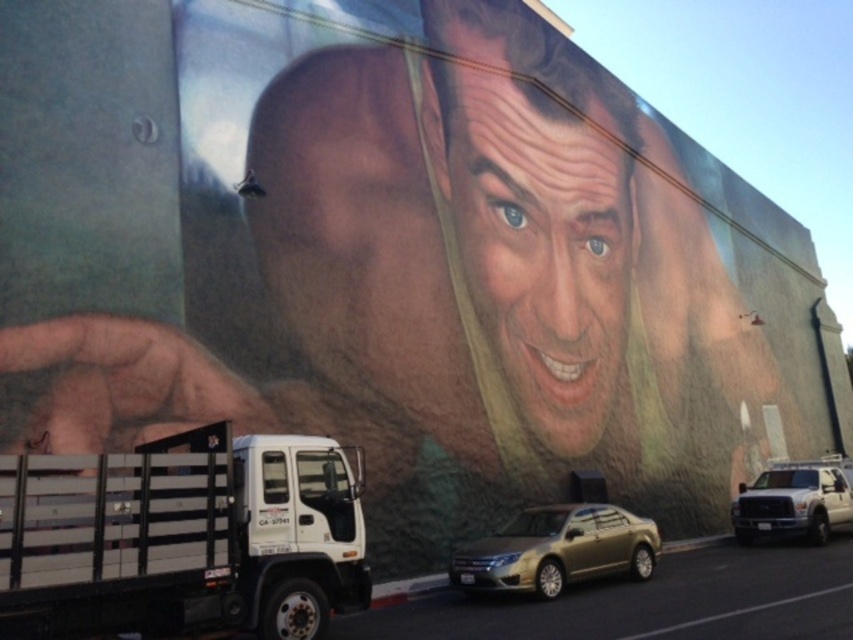
You are a photographer standing in front of the mural and want to capture both the gold metallic sedan at center and the white matte truck at lower right in a single frame. Considering their sizes, which vehicle will appear bigger in your photo?

The gold metallic sedan at center will appear bigger in the photo because it is larger in size than the white matte truck at lower right.

Looking at this image, you are a delivery driver who needs to park your truck between the white matte truck at lower left and the white matte truck at lower right. Since you have a height restriction of 2 meters, which truck should you use as a reference for clearance?

The white matte truck at lower left has a greater height compared to the white matte truck at lower right. Therefore, you should use the white matte truck at lower right as a reference for clearance since it is shorter and ensures your truck stays within the 2 meters height limit.